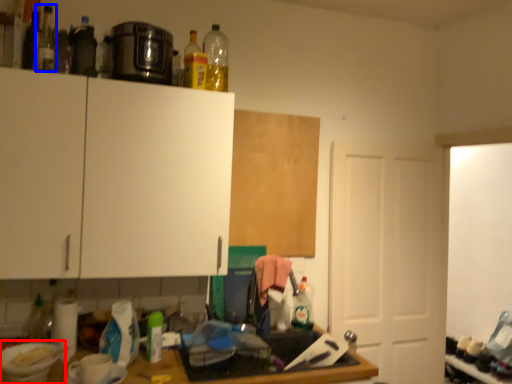
Question: Among these objects, which one is farthest to the camera, appliance (highlighted by a red box) or bottle (highlighted by a blue box)?

Choices:
 (A) appliance
 (B) bottle

Answer: (B)